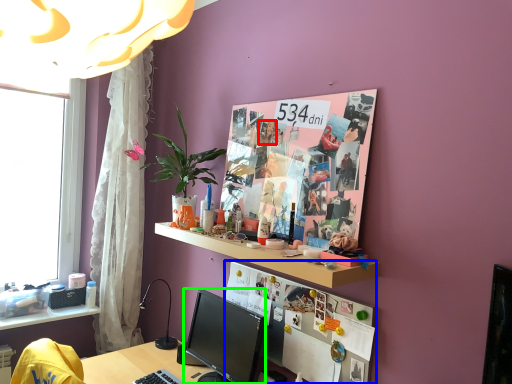
Question: Based on their relative distances, which object is farther from person (highlighted by a red box)? Choose from bulletin board (highlighted by a blue box) and television (highlighted by a green box).

Choices:
 (A) bulletin board
 (B) television

Answer: (B)